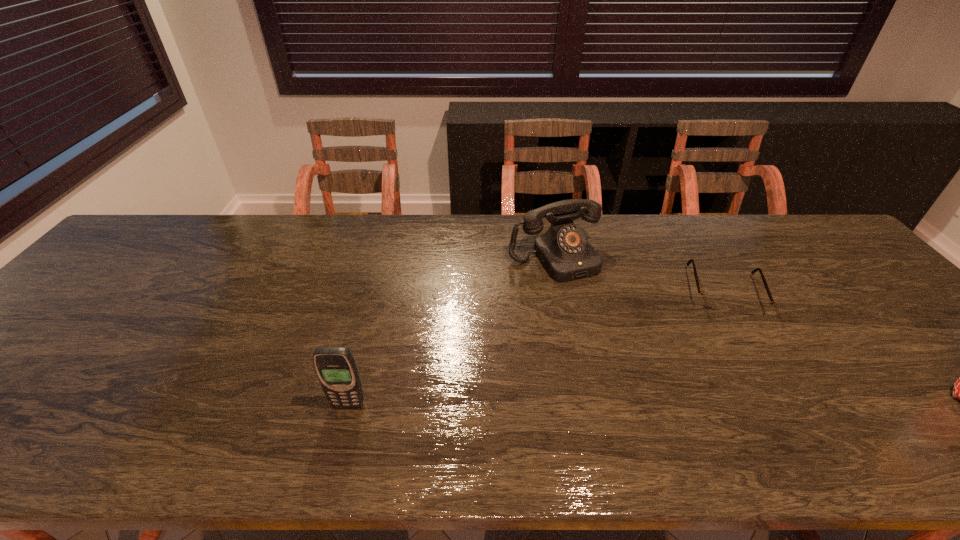
Identify the location of free area in between the spectacles and the telephone. (638, 275).

Locate an element on the screen. The width and height of the screenshot is (960, 540). blank region between the second object from right to left and the spectacles is located at coordinates (638, 275).

At what (x,y) coordinates should I click in order to perform the action: click on vacant space in between the shortest object and the cellular telephone. Please return your answer as a coordinate pair (x, y). Image resolution: width=960 pixels, height=540 pixels. Looking at the image, I should click on (536, 348).

Image resolution: width=960 pixels, height=540 pixels. I want to click on object that stands as the closest to the cellular telephone, so click(564, 251).

Identify which object is the closest to the shortest object. Please provide its 2D coordinates. Your answer should be formatted as a tuple, i.e. [(x, y)], where the tuple contains the x and y coordinates of a point satisfying the conditions above.

[(564, 251)]

The image size is (960, 540). Identify the location of vacant position in the image that satisfies the following two spatial constraints: 1. on the front side of the second object from right to left; 2. on the left side of the spectacles. (561, 292).